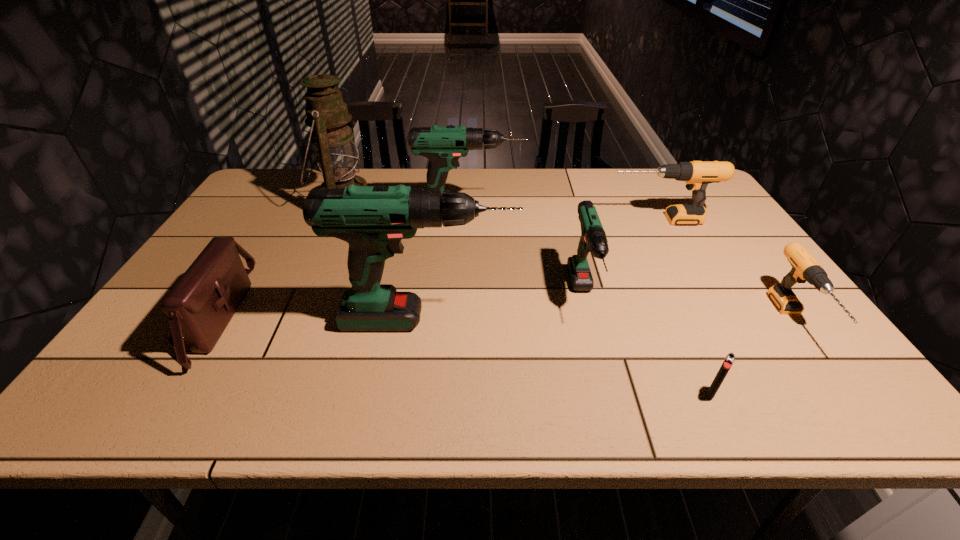
Locate which object is the second closest to the bigger black drill. Please provide its 2D coordinates. Your answer should be formatted as a tuple, i.e. [(x, y)], where the tuple contains the x and y coordinates of a point satisfying the conditions above.

[(443, 145)]

At what (x,y) coordinates should I click in order to perform the action: click on drill that stands as the third closest to the shortest object. Please return your answer as a coordinate pair (x, y). The width and height of the screenshot is (960, 540). Looking at the image, I should click on (373, 220).

Locate an element on the screen. Image resolution: width=960 pixels, height=540 pixels. the second closest drill to the farthest green drill is located at coordinates (697, 174).

Find the location of `green drill that is the closest to the third drill from right to left`. green drill that is the closest to the third drill from right to left is located at coordinates (373, 220).

Identify which green drill is the third closest to the bigger black drill. Please provide its 2D coordinates. Your answer should be formatted as a tuple, i.e. [(x, y)], where the tuple contains the x and y coordinates of a point satisfying the conditions above.

[(373, 220)]

Find the location of a particular element. The height and width of the screenshot is (540, 960). vacant space that satisfies the following two spatial constraints: 1. on the handle side of the third drill from right to left; 2. on the left side of the black igniter is located at coordinates click(609, 394).